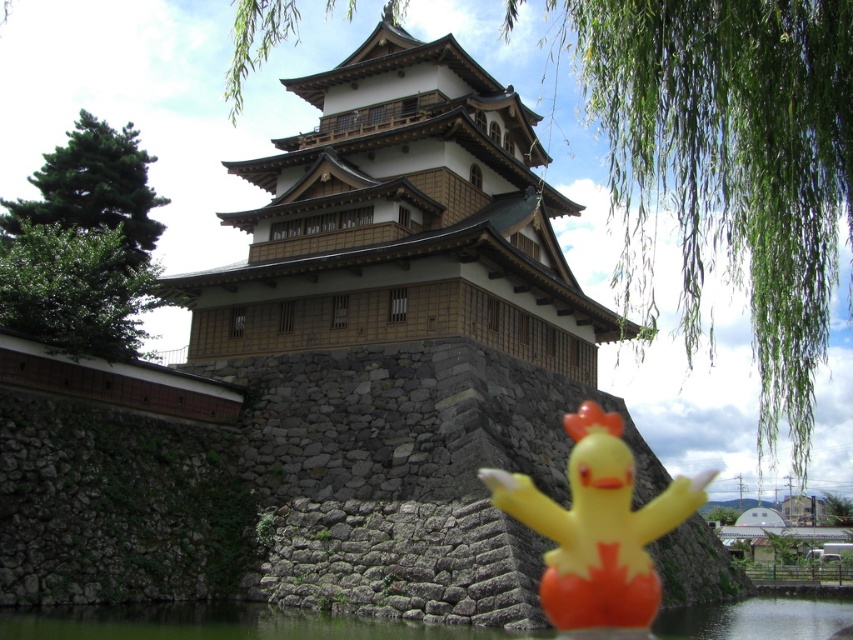
Question: Is yellow rubber duck at center positioned in front of transparent water at lower center?

Choices:
 (A) no
 (B) yes

Answer: (A)

Question: Which point is farther to the camera?

Choices:
 (A) transparent water at lower center
 (B) yellow rubber duck at center

Answer: (B)

Question: Does yellow rubber duck at center lie in front of transparent water at lower center?

Choices:
 (A) yes
 (B) no

Answer: (B)

Question: Is yellow rubber duck at center wider than transparent water at lower center?

Choices:
 (A) yes
 (B) no

Answer: (B)

Question: Among these points, which one is nearest to the camera?

Choices:
 (A) (785, 605)
 (B) (585, 531)

Answer: (B)